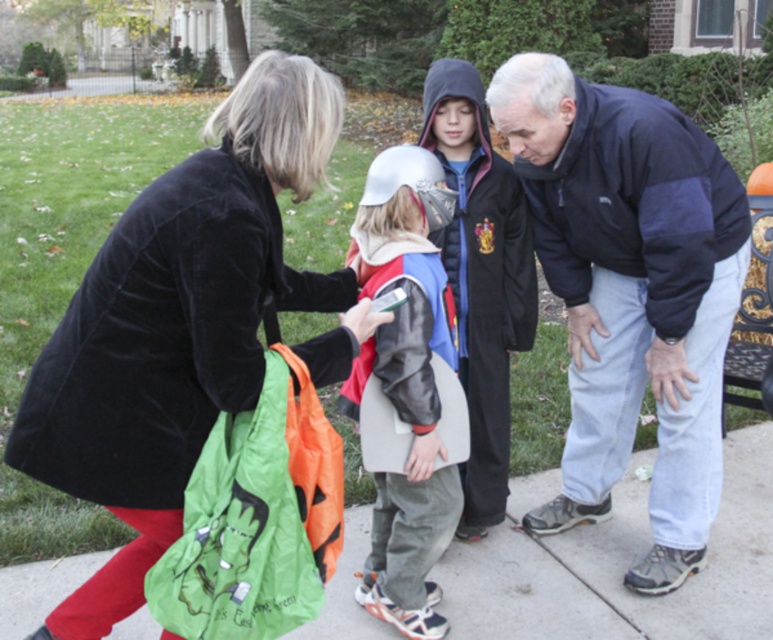
You are a delivery person trying to decide whether to place a small package on the velvet black coat at center or the concrete sidewalk at lower center. Based on their thickness, which surface is more suitable for placing the package?

The concrete sidewalk at lower center is more suitable for placing the package because the velvet black coat at center is thinner, making it less stable compared to the thicker concrete sidewalk.

From the picture: You are standing on the concrete sidewalk at lower center and want to hand a treat to the person wearing the velvet black coat at center. In which direction should you move to reach them?

The velvet black coat at center is positioned on the left side of the concrete sidewalk at lower center, so you should move to your left to reach them.